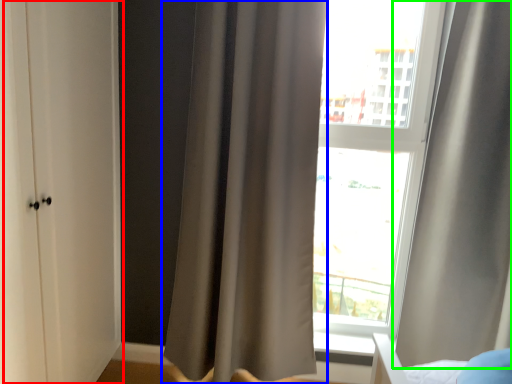
Question: Which object is positioned closest to screen door (highlighted by a red box)? Select from curtain (highlighted by a blue box) and curtain (highlighted by a green box).

Choices:
 (A) curtain
 (B) curtain

Answer: (A)